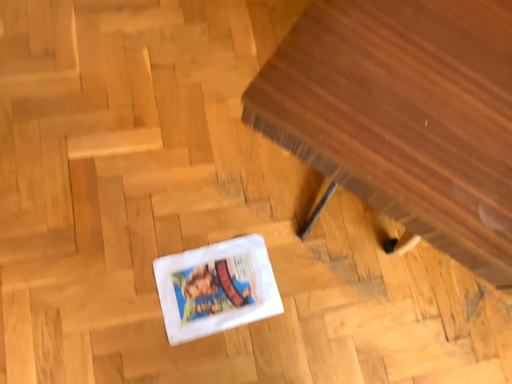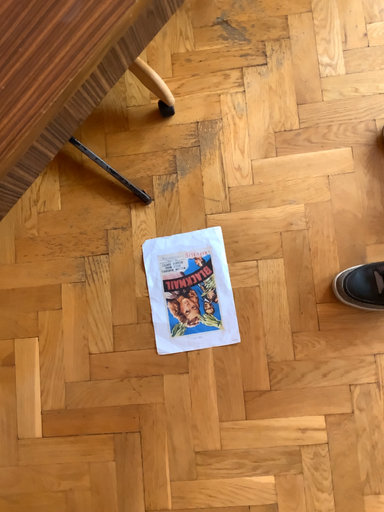
Question: How did the camera likely rotate when shooting the video?

Choices:
 (A) rotated right
 (B) rotated left

Answer: (A)